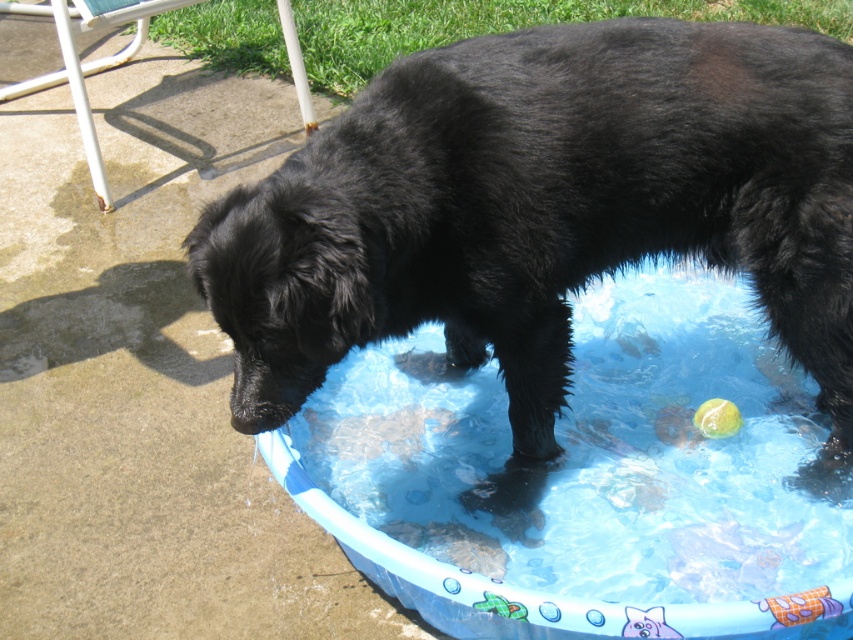
You are a photographer trying to capture the black fluffy dog at center and the blue plastic pool at center in a single shot. Given that your camera can only focus on objects within a 3 meter distance, can you ensure both are in focus if the dog is 2 meters away from you?

The black fluffy dog at center is smaller than the blue plastic pool at center, but since the dog is 2 meters away and the pool is likely positioned further away, both would be within the 3 meter range. Therefore, they can be in focus together.

You are a photographer trying to capture the black fluffy dog at center and the blue plastic pool at center in a single shot. Since you want both subjects to be clearly visible, you need to ensure they are not overlapping too much. Based on their positions, which subject is on the right side and which is on the left side of the frame?

The black fluffy dog at center is on the right side of the blue plastic pool at center, so the dog is on the right and the pool is on the left.

Based on the photo, you are a dog owner who wants to ensure your black fluffy dog at center has easy access to the blue plastic pool at center. Based on the scene, can the dog reach the pool without any obstacles?

The distance between the black fluffy dog at center and the blue plastic pool at center is 47.97 centimeters, so the dog can easily reach the pool without any obstacles since the distance is very short.